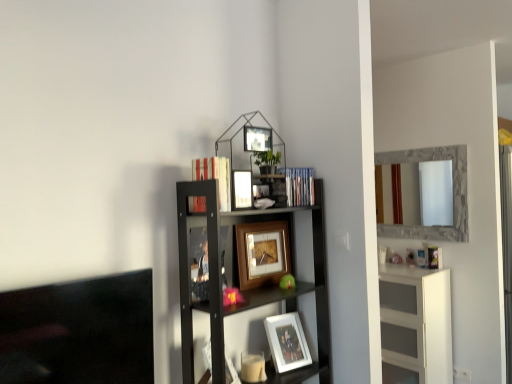
Question: From the image's perspective, is blue plastic book at upper right, which is counted as the 1th book, starting from the back, over hardcover book at upper center, the 2th book in the back-to-front sequence?

Choices:
 (A) yes
 (B) no

Answer: (B)

Question: From a real-world perspective, is blue plastic book at upper right, the 1th book positioned from the right, physically below hardcover book at upper center, the 1th book in the left-to-right sequence?

Choices:
 (A) no
 (B) yes

Answer: (B)

Question: Is blue plastic book at upper right, the 1th book positioned from the right, positioned behind hardcover book at upper center, which is the first book in front-to-back order?

Choices:
 (A) yes
 (B) no

Answer: (A)

Question: Is blue plastic book at upper right, the 1th book positioned from the right, facing away from hardcover book at upper center, the 1th book in the left-to-right sequence?

Choices:
 (A) no
 (B) yes

Answer: (A)

Question: Does blue plastic book at upper right, arranged as the second book when viewed from the front, appear on the left side of hardcover book at upper center, the 2th book in the back-to-front sequence?

Choices:
 (A) yes
 (B) no

Answer: (B)

Question: Based on their positions, is blue plastic book at upper right, marked as the 2th book in a left-to-right arrangement, located to the left or right of wooden picture frame at center, which appears as the 3th picture frame when viewed from the top?

Choices:
 (A) right
 (B) left

Answer: (A)

Question: Based on their sizes in the image, would you say blue plastic book at upper right, which is counted as the 1th book, starting from the back, is bigger or smaller than wooden picture frame at center, which appears as the 3th picture frame when viewed from the top?

Choices:
 (A) small
 (B) big

Answer: (A)

Question: From the image's perspective, is blue plastic book at upper right, marked as the 2th book in a left-to-right arrangement, above or below wooden picture frame at center, the 2th picture frame positioned from the bottom?

Choices:
 (A) above
 (B) below

Answer: (A)

Question: Is blue plastic book at upper right, arranged as the second book when viewed from the front, situated inside wooden picture frame at center, which appears as the 3th picture frame when viewed from the top, or outside?

Choices:
 (A) outside
 (B) inside

Answer: (A)

Question: Considering their positions, is white matte picture frame at lower center, positioned as the fourth picture frame in top-to-bottom order, located in front of or behind white glossy cabinet at right?

Choices:
 (A) behind
 (B) front

Answer: (B)

Question: From a real-world perspective, relative to white glossy cabinet at right, is white matte picture frame at lower center, positioned as the fourth picture frame in top-to-bottom order, vertically above or below?

Choices:
 (A) below
 (B) above

Answer: (B)

Question: Considering the positions of white matte picture frame at lower center, positioned as the fourth picture frame in top-to-bottom order, and white glossy cabinet at right in the image, is white matte picture frame at lower center, positioned as the fourth picture frame in top-to-bottom order, wider or thinner than white glossy cabinet at right?

Choices:
 (A) thin
 (B) wide

Answer: (A)

Question: In terms of height, does white matte picture frame at lower center, positioned as the fourth picture frame in top-to-bottom order, look taller or shorter compared to white glossy cabinet at right?

Choices:
 (A) tall
 (B) short

Answer: (B)

Question: Considering their positions, is hardcover book at upper center, which is the first book in front-to-back order, located in front of or behind white matte picture frame at lower center, acting as the 1th picture frame starting from the bottom?

Choices:
 (A) behind
 (B) front

Answer: (B)

Question: Is hardcover book at upper center, positioned as the 2th book in right-to-left order, wider or thinner than white matte picture frame at lower center, acting as the 1th picture frame starting from the bottom?

Choices:
 (A) wide
 (B) thin

Answer: (A)